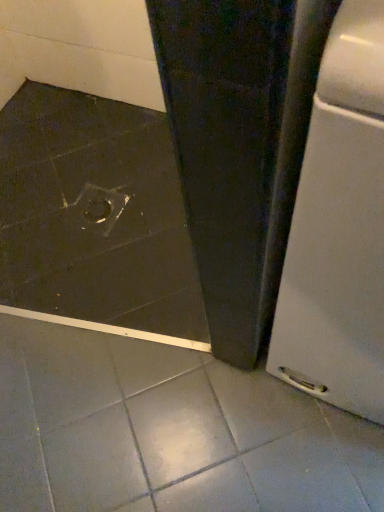
Question: Is white matte refrigerator at lower right turned away from transparent plastic drain at center?

Choices:
 (A) no
 (B) yes

Answer: (A)

Question: From the image's perspective, is white matte refrigerator at lower right located beneath transparent plastic drain at center?

Choices:
 (A) yes
 (B) no

Answer: (A)

Question: Can you confirm if white matte refrigerator at lower right is positioned to the right of transparent plastic drain at center?

Choices:
 (A) yes
 (B) no

Answer: (A)

Question: Does white matte refrigerator at lower right have a lesser height compared to transparent plastic drain at center?

Choices:
 (A) yes
 (B) no

Answer: (B)

Question: From the image's perspective, is white matte refrigerator at lower right located above transparent plastic drain at center?

Choices:
 (A) yes
 (B) no

Answer: (B)

Question: Can you confirm if white matte refrigerator at lower right is taller than transparent plastic drain at center?

Choices:
 (A) yes
 (B) no

Answer: (A)

Question: Does transparent plastic drain at center have a greater height compared to white matte refrigerator at lower right?

Choices:
 (A) yes
 (B) no

Answer: (B)

Question: Is there a large distance between transparent plastic drain at center and white matte refrigerator at lower right?

Choices:
 (A) yes
 (B) no

Answer: (B)

Question: Is transparent plastic drain at center smaller than white matte refrigerator at lower right?

Choices:
 (A) yes
 (B) no

Answer: (A)

Question: Is transparent plastic drain at center directly adjacent to white matte refrigerator at lower right?

Choices:
 (A) no
 (B) yes

Answer: (A)

Question: From the image's perspective, is transparent plastic drain at center under white matte refrigerator at lower right?

Choices:
 (A) yes
 (B) no

Answer: (B)

Question: Is white matte refrigerator at lower right surrounded by transparent plastic drain at center?

Choices:
 (A) no
 (B) yes

Answer: (A)

Question: Does point (324, 292) appear closer or farther from the camera than point (114, 221)?

Choices:
 (A) closer
 (B) farther

Answer: (A)